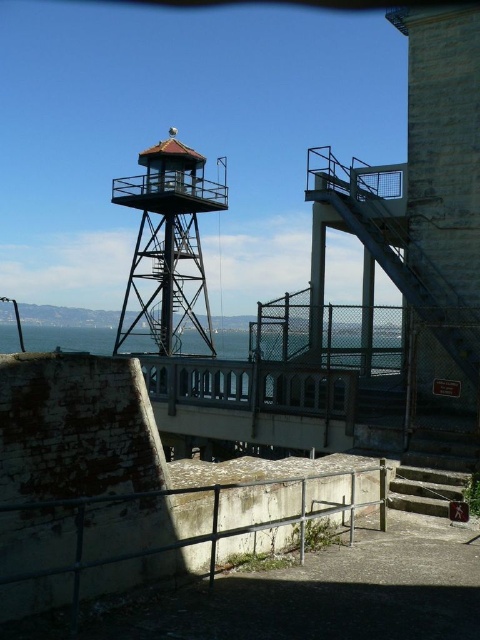
Who is positioned more to the right, rusty metal railing at lower center or concrete stairs at lower right?

concrete stairs at lower right

In the scene shown: Who is shorter, rusty metal railing at lower center or concrete stairs at lower right?

Standing shorter between the two is concrete stairs at lower right.

The width and height of the screenshot is (480, 640). What are the coordinates of `rusty metal railing at lower center` in the screenshot? It's located at (180, 532).

Does metallic red observation tower at upper left appear under concrete stairs at lower right?

Actually, metallic red observation tower at upper left is above concrete stairs at lower right.

In order to click on metallic red observation tower at upper left in this screenshot , I will do `click(168, 244)`.

Identify the location of metallic red observation tower at upper left. (168, 244).

Based on the photo, is rusty metal railing at lower center taller than metallic red observation tower at upper left?

Incorrect, rusty metal railing at lower center's height is not larger of metallic red observation tower at upper left's.

Can you confirm if rusty metal railing at lower center is positioned above metallic red observation tower at upper left?

Incorrect, rusty metal railing at lower center is not positioned above metallic red observation tower at upper left.

Measure the distance between point (x=115, y=557) and camera.

The distance of point (x=115, y=557) from camera is 16.47 feet.

Locate an element on the screen. rusty metal railing at lower center is located at coordinates (180, 532).